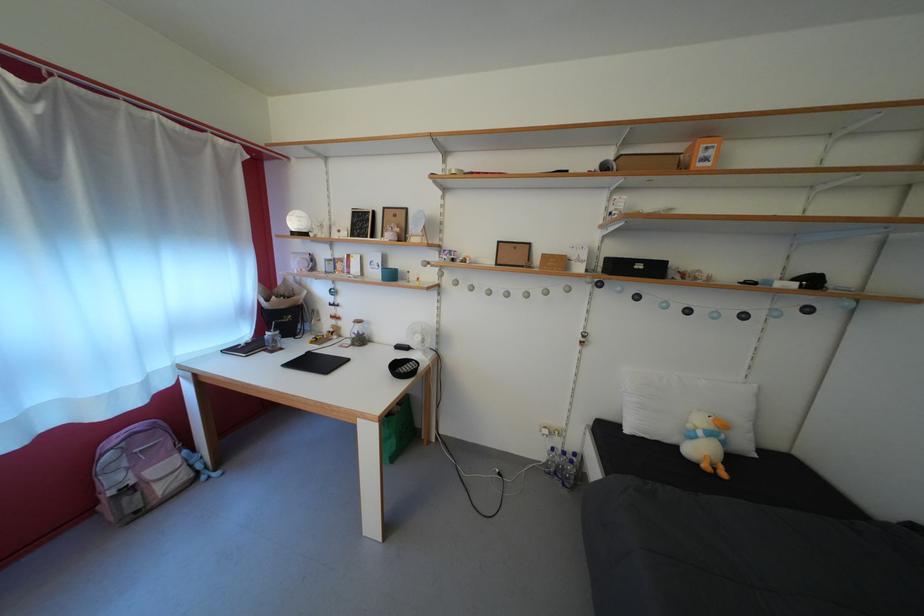
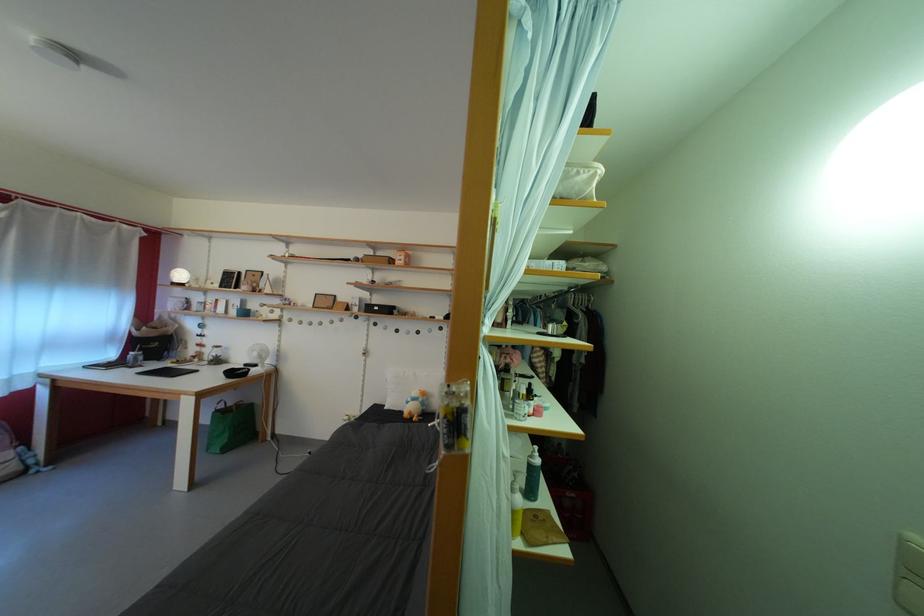
In the second image, find the point that corresponds to point (648, 273) in the first image.

(384, 314)